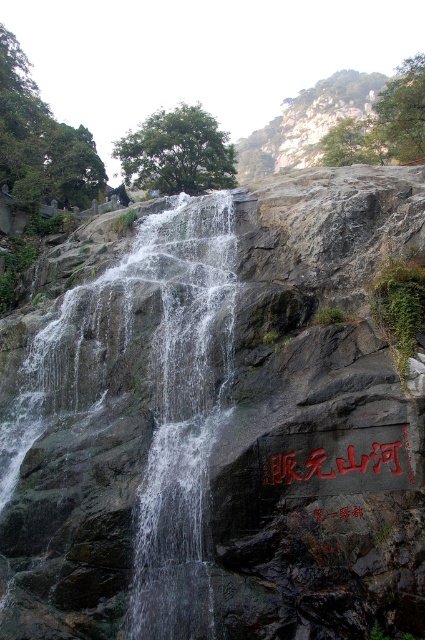
Identify the location of clear water at center. The height and width of the screenshot is (640, 425). (153, 396).

How much distance is there between clear water at center and black stone writing at center?

The distance of clear water at center from black stone writing at center is 23.99 feet.

Is point (175, 595) closer to camera compared to point (368, 465)?

Yes, it is.

Locate an element on the screen. The image size is (425, 640). clear water at center is located at coordinates (153, 396).

Between black stone writing at center and black stone sign at center, which one has more height?

With more height is black stone writing at center.

Between point (351, 468) and point (331, 515), which one is positioned in front?

Point (331, 515) is more forward.

Is point (331, 456) positioned after point (345, 515)?

Yes, it is behind point (345, 515).

Where is `black stone writing at center`? black stone writing at center is located at coordinates (339, 461).

Is clear water at center below black stone sign at center?

Incorrect, clear water at center is not positioned below black stone sign at center.

Can you confirm if clear water at center is thinner than black stone sign at center?

No, clear water at center is not thinner than black stone sign at center.

Locate an element on the screen. The height and width of the screenshot is (640, 425). clear water at center is located at coordinates (153, 396).